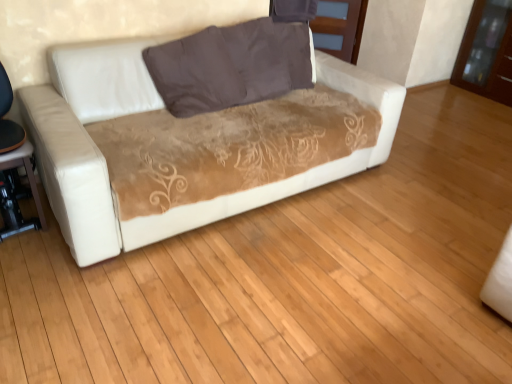
Question: In terms of size, does matte black table at lower left appear bigger or smaller than brown fabric pillow at center?

Choices:
 (A) small
 (B) big

Answer: (A)

Question: Would you say matte black table at lower left is to the left or to the right of brown fabric pillow at center in the picture?

Choices:
 (A) right
 (B) left

Answer: (B)

Question: Which object is positioned closest to the brown fabric pillow at center?

Choices:
 (A) brown glossy dresser at upper right, acting as the first dresser starting from the right
 (B) matte black table at lower left
 (C) matte brown wood dresser at upper center, placed as the first dresser when sorted from left to right
 (D) white leather couch at center

Answer: (D)

Question: Based on their relative distances, which object is nearer to the brown glossy dresser at upper right, the second dresser viewed from the left?

Choices:
 (A) white leather couch at center
 (B) brown fabric pillow at center
 (C) matte black table at lower left
 (D) matte brown wood dresser at upper center, acting as the second dresser starting from the right

Answer: (D)